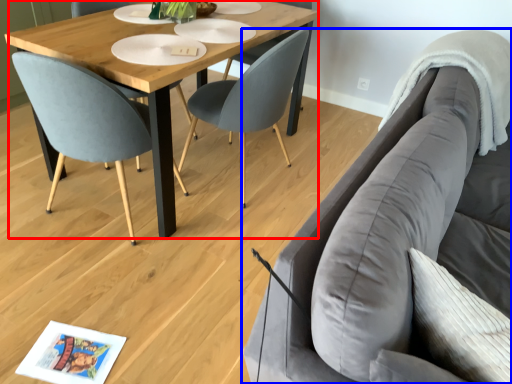
Question: Which of the following is the closest to the observer, coffee table (highlighted by a red box) or studio couch (highlighted by a blue box)?

Choices:
 (A) coffee table
 (B) studio couch

Answer: (B)